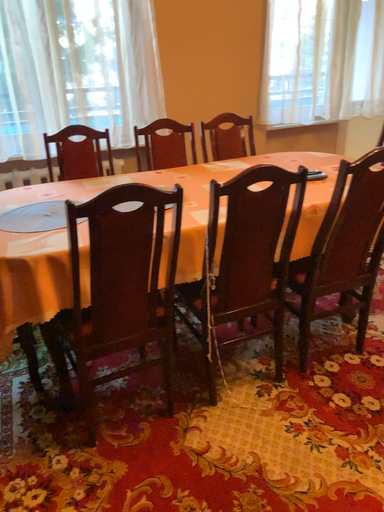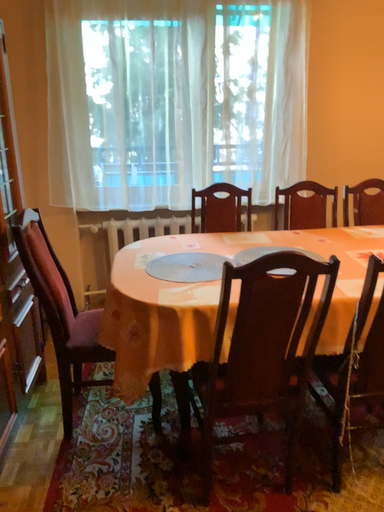
Question: Which way did the camera rotate in the video?

Choices:
 (A) rotated right
 (B) rotated left

Answer: (B)